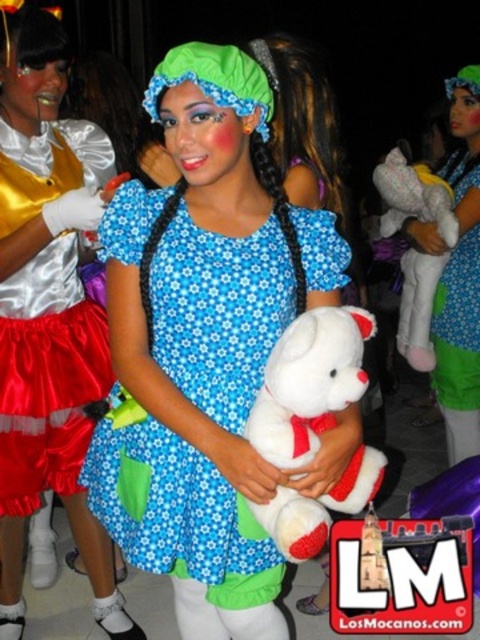
Question: Which object is positioned closest to the white plush bear at center?

Choices:
 (A) satin red skirt at left
 (B) blue floral fabric dress at center
 (C) matte blue dress at center

Answer: (B)

Question: Is blue floral fabric dress at center below white plush bear at center?

Choices:
 (A) no
 (B) yes

Answer: (A)

Question: Among these points, which one is farthest from the camera?

Choices:
 (A) (460, 374)
 (B) (56, 129)
 (C) (326, 422)

Answer: (A)

Question: Does blue floral fabric dress at center appear over satin red skirt at left?

Choices:
 (A) yes
 (B) no

Answer: (B)

Question: Which of these objects is positioned farthest from the blue floral fabric dress at center?

Choices:
 (A) white plush bear at center
 (B) matte blue dress at center

Answer: (B)

Question: Is white plush bear at center above matte blue dress at center?

Choices:
 (A) yes
 (B) no

Answer: (B)